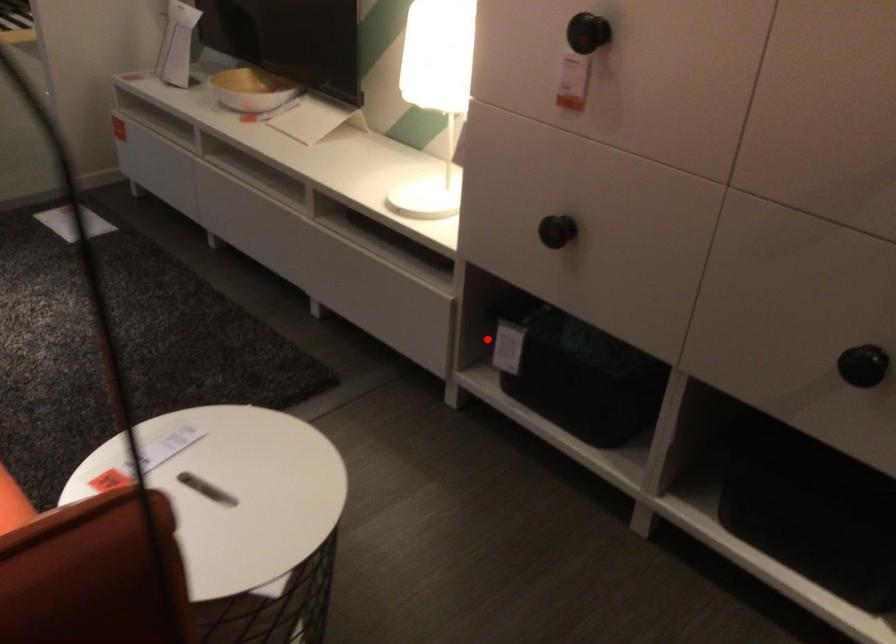
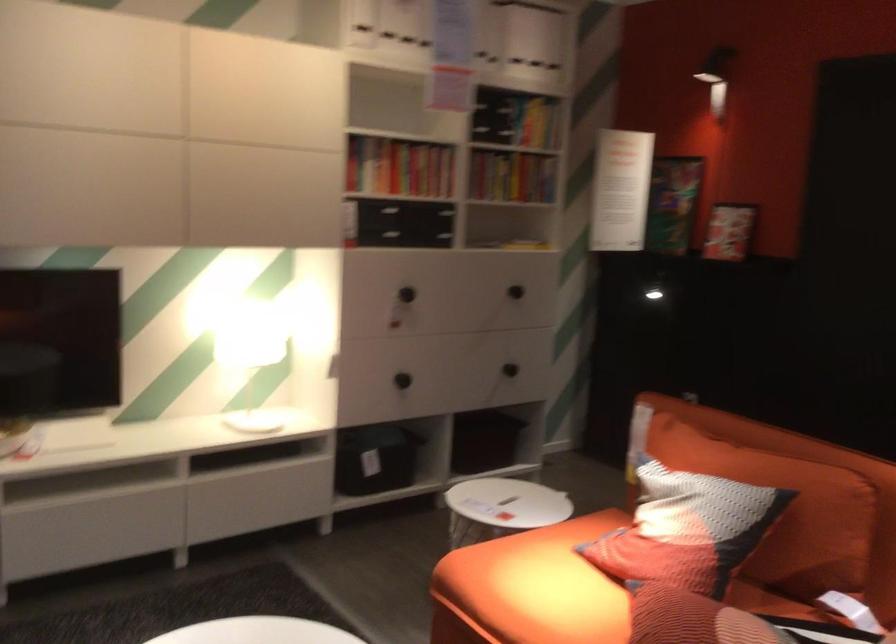
The point at the highlighted location is marked in the first image. Where is the corresponding point in the second image?

(375, 459)